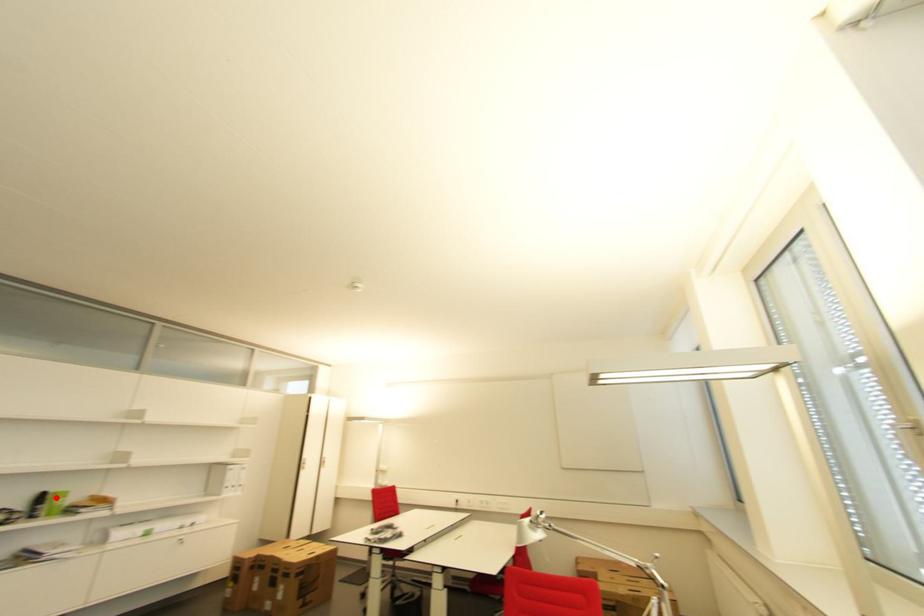
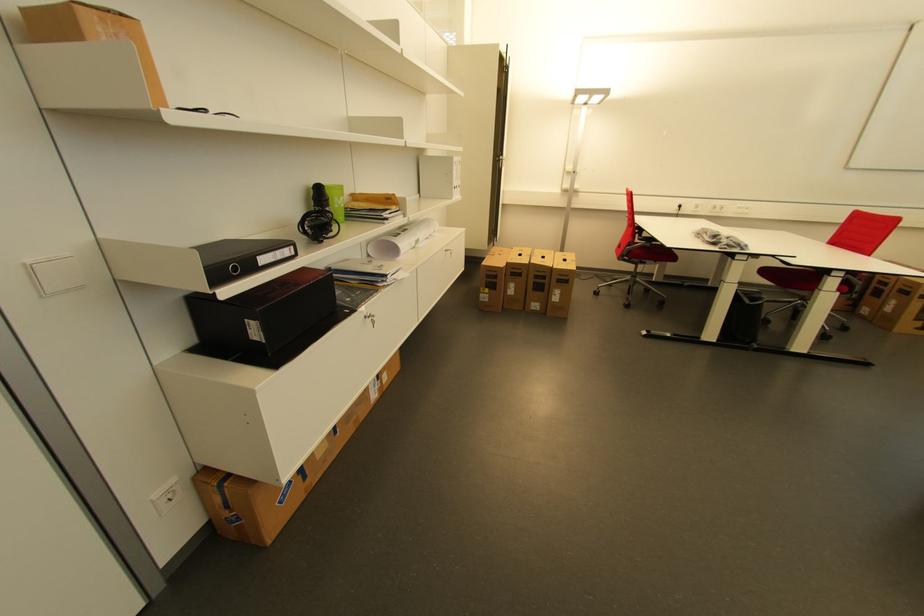
Question: I am providing you with two images of the same scene from different viewpoints. A red point is shown in image1. For the corresponding object point in image2, is it positioned nearer or farther from the camera?

Choices:
 (A) Nearer
 (B) Farther

Answer: (B)